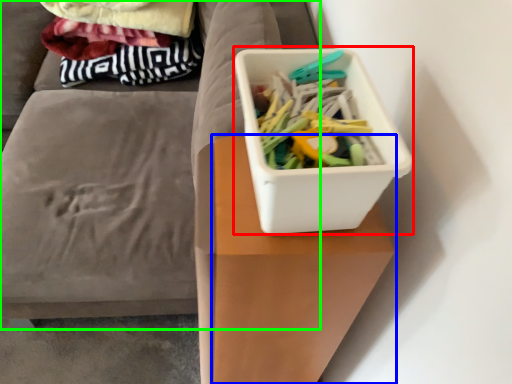
Question: Estimate the real-world distances between objects in this image. Which object is closer to storage box (highlighted by a red box), table (highlighted by a blue box) or furniture (highlighted by a green box)?

Choices:
 (A) table
 (B) furniture

Answer: (A)